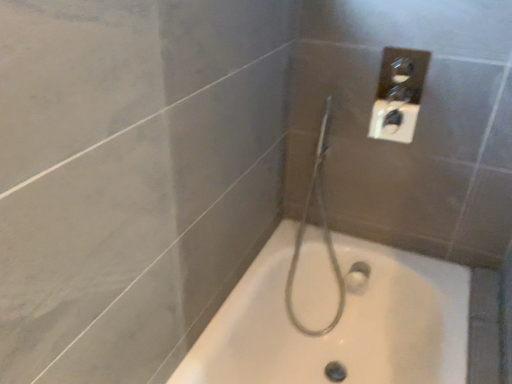
Locate an element on the screen. The image size is (512, 384). white glossy bathtub at center is located at coordinates (340, 323).

This screenshot has width=512, height=384. Describe the element at coordinates (340, 323) in the screenshot. I see `white glossy bathtub at center` at that location.

Find the location of `silver metallic shower head at center`. silver metallic shower head at center is located at coordinates (323, 232).

What do you see at coordinates (323, 232) in the screenshot? This screenshot has height=384, width=512. I see `silver metallic shower head at center` at bounding box center [323, 232].

Where is `white glossy bathtub at center`? white glossy bathtub at center is located at coordinates (340, 323).

Does silver metallic shower head at center appear on the right side of white glossy bathtub at center?

No, silver metallic shower head at center is not to the right of white glossy bathtub at center.

Which object is further away from the camera taking this photo, silver metallic shower head at center or white glossy bathtub at center?

silver metallic shower head at center is further from the camera.

Which is behind, point (293, 269) or point (184, 359)?

Positioned behind is point (293, 269).

From the image's perspective, who appears lower, silver metallic shower head at center or white glossy bathtub at center?

white glossy bathtub at center, from the image's perspective.

From a real-world perspective, between silver metallic shower head at center and white glossy bathtub at center, who is vertically lower?

In real-world perspective, white glossy bathtub at center is lower.

Considering the sizes of objects silver metallic shower head at center and white glossy bathtub at center in the image provided, who is thinner, silver metallic shower head at center or white glossy bathtub at center?

silver metallic shower head at center is thinner.

Is silver metallic shower head at center taller than white glossy bathtub at center?

Yes, silver metallic shower head at center is taller than white glossy bathtub at center.

Between silver metallic shower head at center and white glossy bathtub at center, which one has smaller size?

silver metallic shower head at center.

Is white glossy bathtub at center located within silver metallic shower head at center?

That's incorrect, white glossy bathtub at center is not inside silver metallic shower head at center.

Would you consider silver metallic shower head at center to be distant from white glossy bathtub at center?

silver metallic shower head at center is actually quite close to white glossy bathtub at center.

Could you tell me if silver metallic shower head at center is facing white glossy bathtub at center?

Yes.

In the scene shown: How many degrees apart are the facing directions of silver metallic shower head at center and white glossy bathtub at center?

The angular difference between silver metallic shower head at center and white glossy bathtub at center is 25.8 degrees.

How distant is silver metallic shower head at center from white glossy bathtub at center?

8.40 inches.

Identify the location of shower above the white glossy bathtub at center (from a real-world perspective). This screenshot has width=512, height=384. (x=323, y=232).

Which object is positioned more to the right, white glossy bathtub at center or silver metallic shower head at center?

From the viewer's perspective, white glossy bathtub at center appears more on the right side.

In the scene shown: Which object is more forward, white glossy bathtub at center or silver metallic shower head at center?

white glossy bathtub at center.

Between point (311, 306) and point (303, 326), which one is positioned behind?

Point (303, 326)

From the image's perspective, is white glossy bathtub at center located above or below silver metallic shower head at center?

white glossy bathtub at center is situated lower than silver metallic shower head at center in the image.

From a real-world perspective, relative to silver metallic shower head at center, is white glossy bathtub at center vertically above or below?

white glossy bathtub at center is situated lower than silver metallic shower head at center in the real world.

Which object is thinner, white glossy bathtub at center or silver metallic shower head at center?

Thinner between the two is silver metallic shower head at center.

Consider the image. Between white glossy bathtub at center and silver metallic shower head at center, which one has less height?

white glossy bathtub at center is shorter.

Consider the image. Does white glossy bathtub at center have a larger size compared to silver metallic shower head at center?

Yes.

Is white glossy bathtub at center situated inside silver metallic shower head at center or outside?

white glossy bathtub at center is located beyond the bounds of silver metallic shower head at center.

Is white glossy bathtub at center touching silver metallic shower head at center?

There is a gap between white glossy bathtub at center and silver metallic shower head at center.

Is white glossy bathtub at center oriented towards silver metallic shower head at center?

No, white glossy bathtub at center is not oriented towards silver metallic shower head at center.

Image resolution: width=512 pixels, height=384 pixels. Find the location of `shower on the left side of white glossy bathtub at center`. shower on the left side of white glossy bathtub at center is located at coordinates (323, 232).

This screenshot has height=384, width=512. In order to click on shower above the white glossy bathtub at center (from the image's perspective) in this screenshot , I will do `click(323, 232)`.

The height and width of the screenshot is (384, 512). In order to click on shower on the left of white glossy bathtub at center in this screenshot , I will do (323, 232).